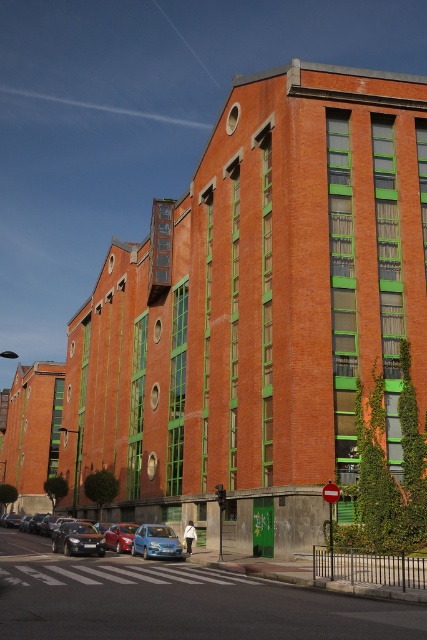
You are driving a car and see the metallic blue hatchback at center and the metallic blue sedan at center in front of you. Which one is positioned more to your right side?

The metallic blue hatchback at center is positioned more to the right side compared to the metallic blue sedan at center.

You are standing at the base of the modern urban building and want to take a photo of the point at coordinates (166, 552). Your camera has a maximum zoom range of 30 meters. Can you capture the point clearly without moving closer?

The point at coordinates (166, 552) is 27.77 meters from the camera, which is within the camera maximum zoom range of 30 meters. Therefore, you can capture the point clearly without moving closer.

You are standing at the base of the modern urban building and looking up at its facade. There are two points marked on the building wall, one at coordinates point (x=72, y=524) and the other at point (x=170, y=545). Which of these points is closer to you?

Point (x=170, y=545) is closer to you because point (x=72, y=524) is behind it.